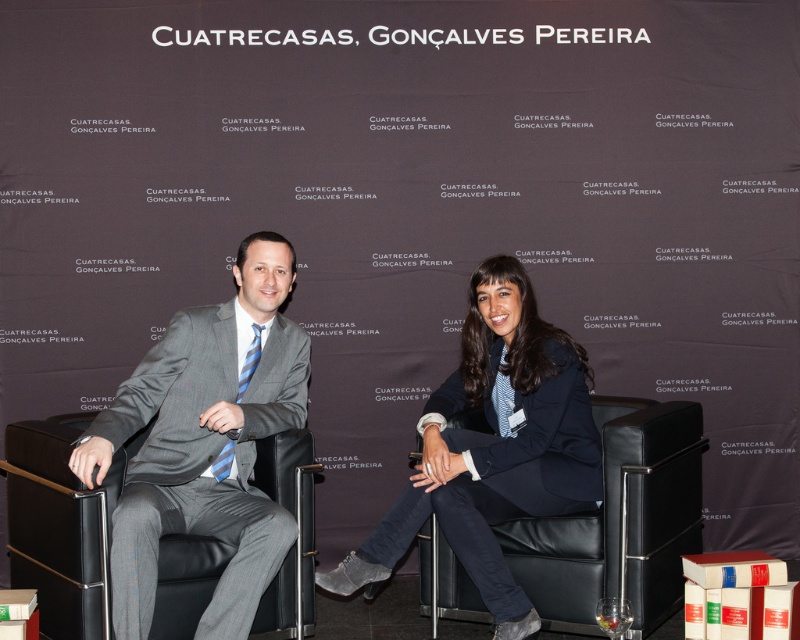
You are standing in front of the two individuals seated on black armchairs in the formal setting. If you were to draw a straight line from your current position to each of the points labeled point (424, 573) and point (168, 632), which point would require a longer path?

Point (424, 573) is behind point (168, 632), so the path to point (424, 573) would be longer.